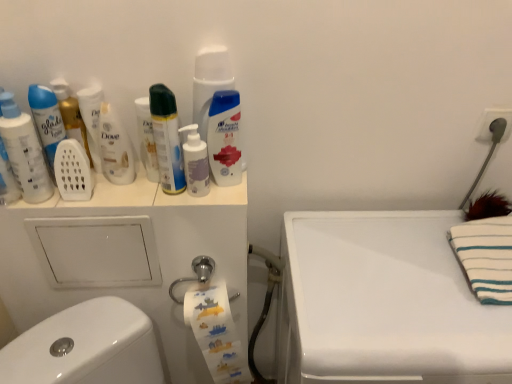
Question: Is white matte pump bottle at center, marked as the 2th mouthwash in a right-to-left arrangement, with white matte plastic mouthwash at upper left, arranged as the fourth mouthwash when viewed from the right?

Choices:
 (A) yes
 (B) no

Answer: (B)

Question: Would you consider white matte pump bottle at center, marked as the 2th mouthwash in a right-to-left arrangement, to be distant from white matte plastic mouthwash at upper left, placed as the 3th mouthwash when sorted from left to right?

Choices:
 (A) no
 (B) yes

Answer: (A)

Question: Is white matte pump bottle at center, marked as the 2th mouthwash in a right-to-left arrangement, looking in the opposite direction of white matte plastic mouthwash at upper left, arranged as the fourth mouthwash when viewed from the right?

Choices:
 (A) yes
 (B) no

Answer: (B)

Question: Could you tell me if white matte pump bottle at center, marked as the 2th mouthwash in a right-to-left arrangement, is facing white matte plastic mouthwash at upper left, placed as the 3th mouthwash when sorted from left to right?

Choices:
 (A) no
 (B) yes

Answer: (A)

Question: From the image's perspective, does white matte pump bottle at center, marked as the 2th mouthwash in a right-to-left arrangement, appear lower than white matte plastic mouthwash at upper left, placed as the 3th mouthwash when sorted from left to right?

Choices:
 (A) no
 (B) yes

Answer: (B)

Question: From the image's perspective, does white matte pump bottle at center, marked as the 2th mouthwash in a right-to-left arrangement, appear higher than white matte plastic mouthwash at upper left, arranged as the fourth mouthwash when viewed from the right?

Choices:
 (A) yes
 (B) no

Answer: (B)

Question: From the image's perspective, is white striped towel at upper right over white glossy counter top at upper right?

Choices:
 (A) yes
 (B) no

Answer: (A)

Question: Is white striped towel at upper right further to camera compared to white glossy counter top at upper right?

Choices:
 (A) no
 (B) yes

Answer: (B)

Question: Can we say white striped towel at upper right lies outside white glossy counter top at upper right?

Choices:
 (A) yes
 (B) no

Answer: (A)

Question: Is white striped towel at upper right not close to white glossy counter top at upper right?

Choices:
 (A) yes
 (B) no

Answer: (B)

Question: Can you confirm if white striped towel at upper right is positioned to the left of white glossy counter top at upper right?

Choices:
 (A) yes
 (B) no

Answer: (B)

Question: Is white striped towel at upper right taller than white glossy counter top at upper right?

Choices:
 (A) yes
 (B) no

Answer: (B)

Question: Is white glossy counter top at upper right bigger than white matte plastic mouthwash at upper left, arranged as the fourth mouthwash when viewed from the right?

Choices:
 (A) yes
 (B) no

Answer: (A)